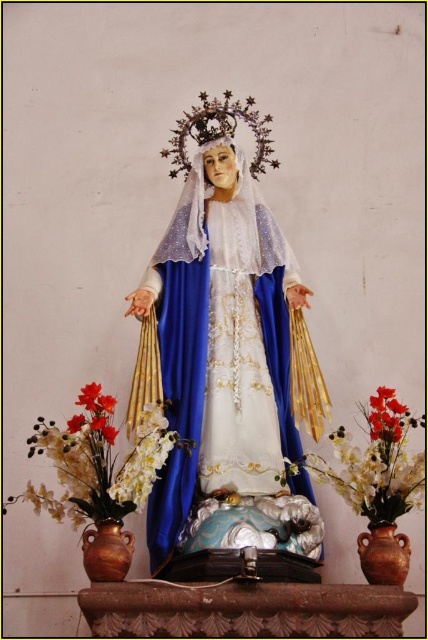
You are a maintenance worker in a church and need to clean the area around the silky white petals at lower center and the brown earthenware vase at lower right. Which object is closer to you so you can start cleaning first?

The silky white petals at lower center is closer to you than the brown earthenware vase at lower right, so you can start cleaning the silky white petals at lower center first.

You are a florist arranging flowers for a religious event. You need to place a new bouquet that requires more space than the existing arrangements. Which object between the silky white petals at lower center and the brown earthenware vase at lower right would you choose to move to accommodate the larger bouquet?

The silky white petals at lower center is bigger than the brown earthenware vase at lower right, so moving the silky white petals at lower center would free up more space for the larger bouquet.